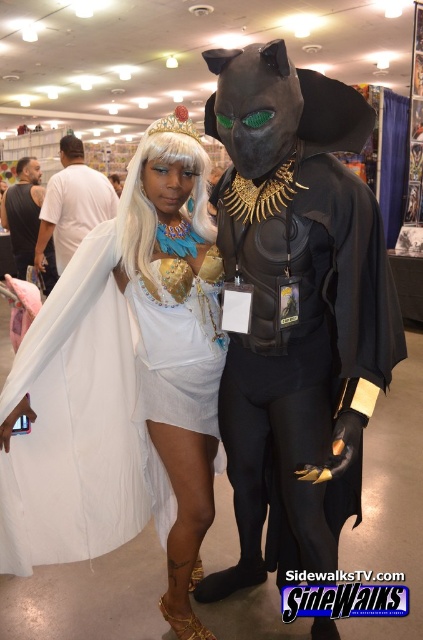
You are at the convention and want to take a photo of both the point at (96, 490) and the point at (79, 163). Which point should you focus on first to ensure both are in clear view?

You should focus on point (79, 163) first because it is behind point (96, 490), so focusing on the farther point will keep both in focus.

You are a photographer at the event and need to adjust the camera focus. Since the white satin dress at center and the white silky wig at center are both in the frame, which one should you focus on first if you want to ensure the taller object is in focus?

The white satin dress at center has a greater height compared to the white silky wig at center, so you should focus on the white satin dress at center first to ensure the taller object is in focus.

You are at the convention and want to take a photo of both the person on the left and the person on the right. You notice two points marked as point 1 and point 2 on the image. Point 1 is at coordinate [140,157] and point 2 is at [30,182]. Based on their positions, which point is closer to the front of the scene?

Point 1 at coordinate [140,157] is in front of point 2 at [30,182], so point 1 is closer to the front of the scene.